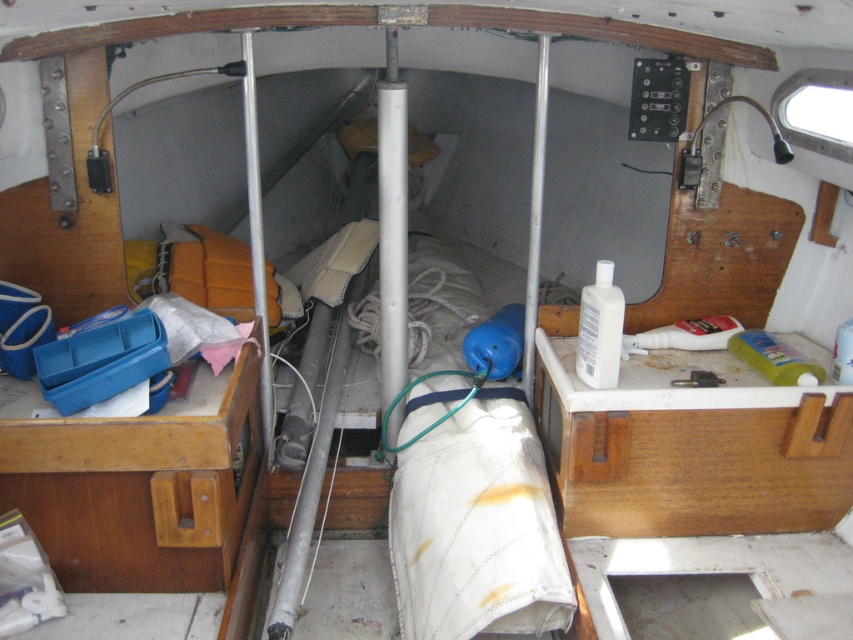
Can you confirm if wooden drawer at left is shorter than metallic silver tool at center?

No, wooden drawer at left is not shorter than metallic silver tool at center.

Is point (228, 428) positioned after point (708, 372)?

No, it is in front of (708, 372).

The height and width of the screenshot is (640, 853). I want to click on wooden drawer at left, so click(141, 486).